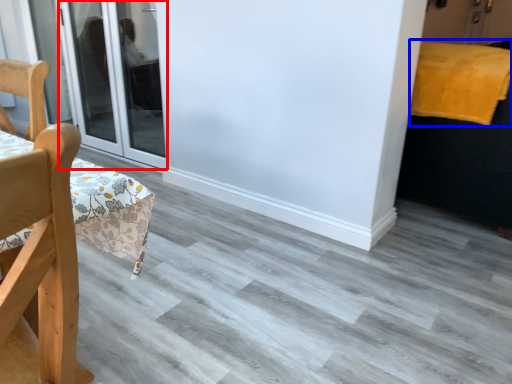
Question: Which object appears closest to the camera in this image, door (highlighted by a red box) or blanket (highlighted by a blue box)?

Choices:
 (A) door
 (B) blanket

Answer: (B)